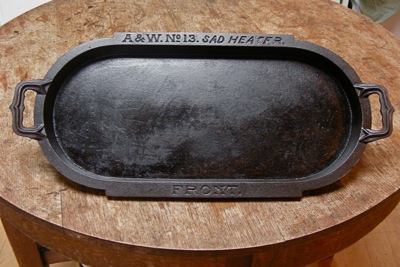
Where is `floor`? The width and height of the screenshot is (400, 267). floor is located at coordinates (364, 255), (6, 259).